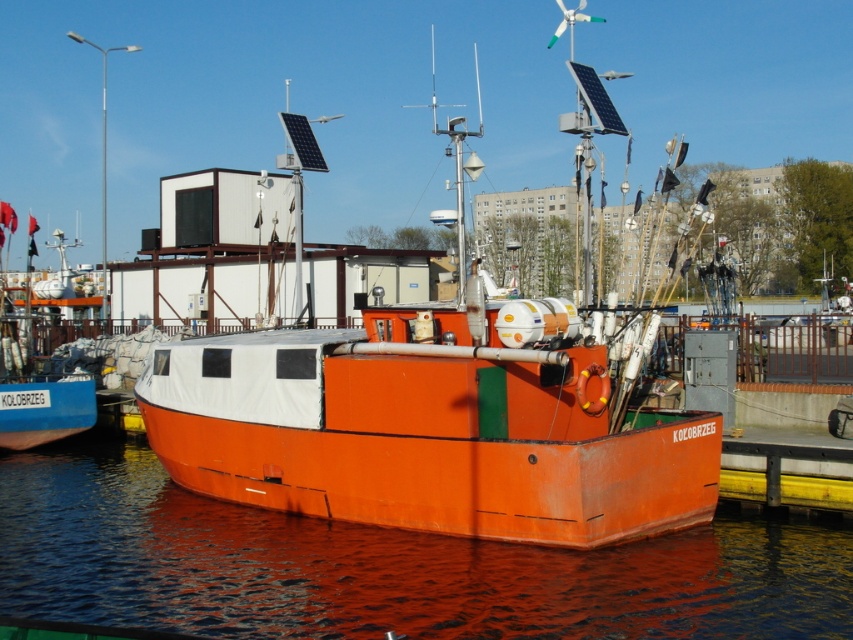
Question: Among these objects, which one is farthest from the camera?

Choices:
 (A) orange matte boat at center
 (B) glossy orange water at lower center

Answer: (A)

Question: Which point appears closest to the camera in this image?

Choices:
 (A) (19, 552)
 (B) (30, 323)
 (C) (140, 394)

Answer: (A)

Question: Does orange matte boat at center have a larger size compared to glossy orange water at lower center?

Choices:
 (A) yes
 (B) no

Answer: (A)

Question: Can you confirm if orange matte boat at center is bigger than glossy orange water at lower center?

Choices:
 (A) yes
 (B) no

Answer: (A)

Question: Is orange matte boat at center positioned in front of orange matte boat at left?

Choices:
 (A) no
 (B) yes

Answer: (B)

Question: Which point is closer to the camera?

Choices:
 (A) orange matte boat at center
 (B) glossy orange water at lower center

Answer: (B)